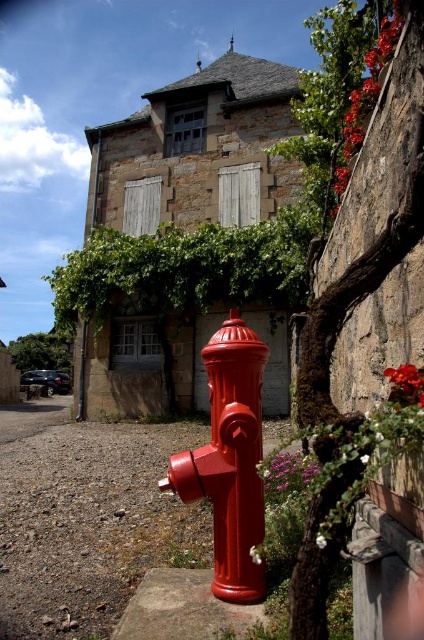
You are a painter standing in front of the rustic stone building. You want to paint the purple matte flower at lower center and the smooth glossy petal at center right. Which of the two has a larger width?

The purple matte flower at lower center has a larger width than the smooth glossy petal at center right.